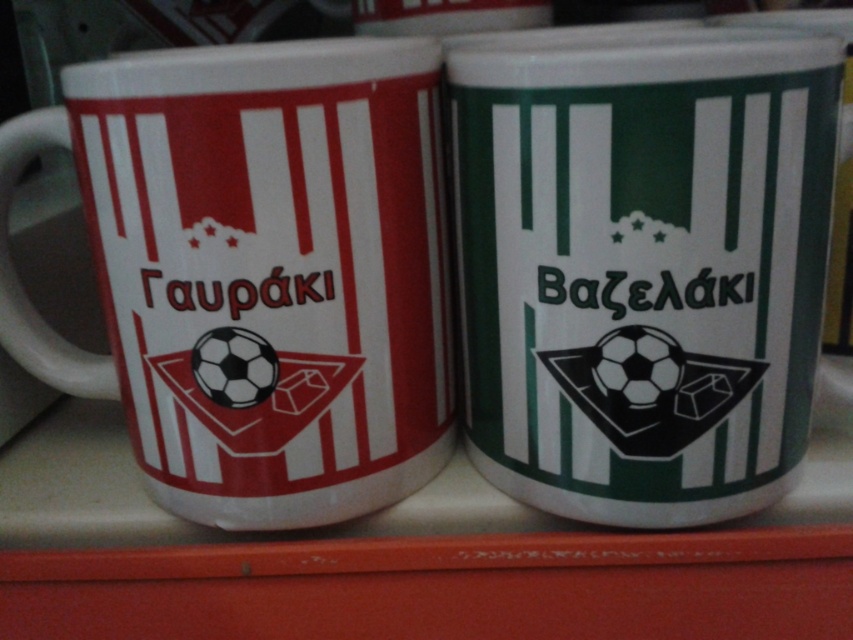
Question: Does green matte mug at center appear over matte white mug at left?

Choices:
 (A) yes
 (B) no

Answer: (A)

Question: Which of the following is the closest to the observer?

Choices:
 (A) matte white mug at left
 (B) green matte mug at center

Answer: (B)

Question: Among these points, which one is farthest from the camera?

Choices:
 (A) (354, 504)
 (B) (720, 472)

Answer: (A)

Question: Does green matte mug at center appear over matte white mug at left?

Choices:
 (A) no
 (B) yes

Answer: (B)

Question: Can you confirm if green matte mug at center is wider than matte white mug at left?

Choices:
 (A) no
 (B) yes

Answer: (A)

Question: Which point is farther from the camera taking this photo?

Choices:
 (A) (300, 250)
 (B) (711, 141)

Answer: (A)